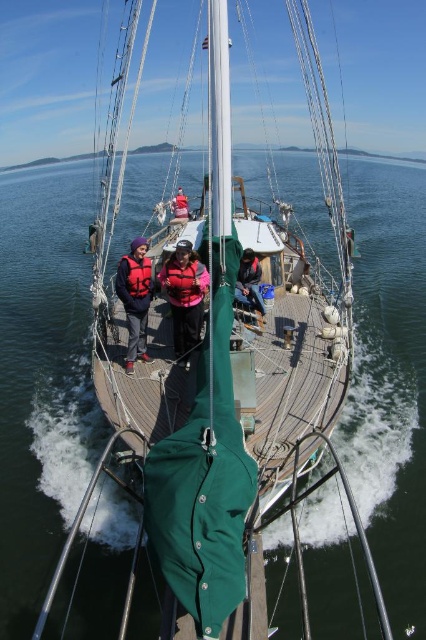
Is matte black jacket at center smaller than matte pink life jacket at center?

Correct, matte black jacket at center occupies less space than matte pink life jacket at center.

Which of these two, matte black jacket at center or matte pink life jacket at center, stands shorter?

matte black jacket at center is shorter.

Locate an element on the screen. The height and width of the screenshot is (640, 426). matte black jacket at center is located at coordinates (135, 298).

This screenshot has height=640, width=426. In order to click on matte black jacket at center in this screenshot , I will do `click(135, 298)`.

At what (x,y) coordinates should I click in order to perform the action: click on dark blue fabric jacket at center. Please return your answer as a coordinate pair (x, y). Image resolution: width=426 pixels, height=640 pixels. Looking at the image, I should click on (249, 282).

Can you confirm if dark blue fabric jacket at center is bigger than red life jacket at center?

No, dark blue fabric jacket at center is not bigger than red life jacket at center.

Find the location of a particular element. The width and height of the screenshot is (426, 640). dark blue fabric jacket at center is located at coordinates (249, 282).

What are the coordinates of `dark blue fabric jacket at center` in the screenshot? It's located at (249, 282).

Is matte pink life vest at center in front of orange life jacket at center?

Yes.

From the picture: Does matte pink life vest at center appear on the left side of orange life jacket at center?

In fact, matte pink life vest at center is to the right of orange life jacket at center.

Measure the distance between point [189,250] and camera.

The distance of point [189,250] from camera is 10.93 meters.

Locate an element on the screen. This screenshot has width=426, height=640. matte pink life vest at center is located at coordinates click(x=184, y=296).